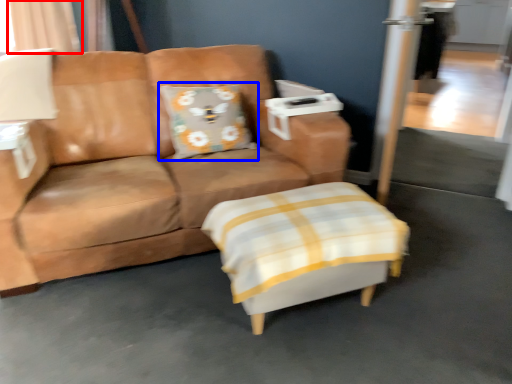
Question: Which object appears farthest to the camera in this image, curtain (highlighted by a red box) or pillow (highlighted by a blue box)?

Choices:
 (A) curtain
 (B) pillow

Answer: (A)